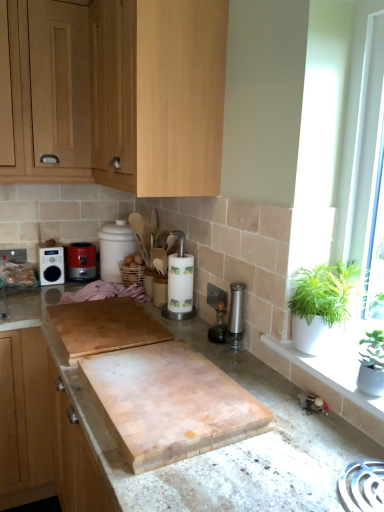
Question: From the image's perspective, is white wooden frame at right above or below light wood cabinet at left, the third cabinetry when ordered from top to bottom?

Choices:
 (A) below
 (B) above

Answer: (B)

Question: Based on their positions, is white wooden frame at right located to the left or right of light wood cabinet at left, the first cabinetry from the bottom?

Choices:
 (A) left
 (B) right

Answer: (B)

Question: Which object is the farthest from the light wood cabinet at upper left, which is counted as the 1th cabinetry, starting from the top?

Choices:
 (A) green leafy plant at right, the first houseplant positioned from the back
 (B) light wood cabinet at left, the third cabinetry when ordered from top to bottom
 (C) white wooden frame at right
 (D) green leafy plant in white pot at right, marked as the 1th houseplant in a front-to-back arrangement
 (E) matte black radio at left

Answer: (D)

Question: Considering the real-world distances, which object is closest to the metallic red toaster at left?

Choices:
 (A) white wooden frame at right
 (B) light wood cabinet at upper left, the 2th cabinetry positioned from the bottom
 (C) green leafy plant at right, the second houseplant when ordered from front to back
 (D) light wood cabinet at upper left, which is counted as the 1th cabinetry, starting from the top
 (E) light wood cabinet at left, the third cabinetry when ordered from top to bottom

Answer: (E)